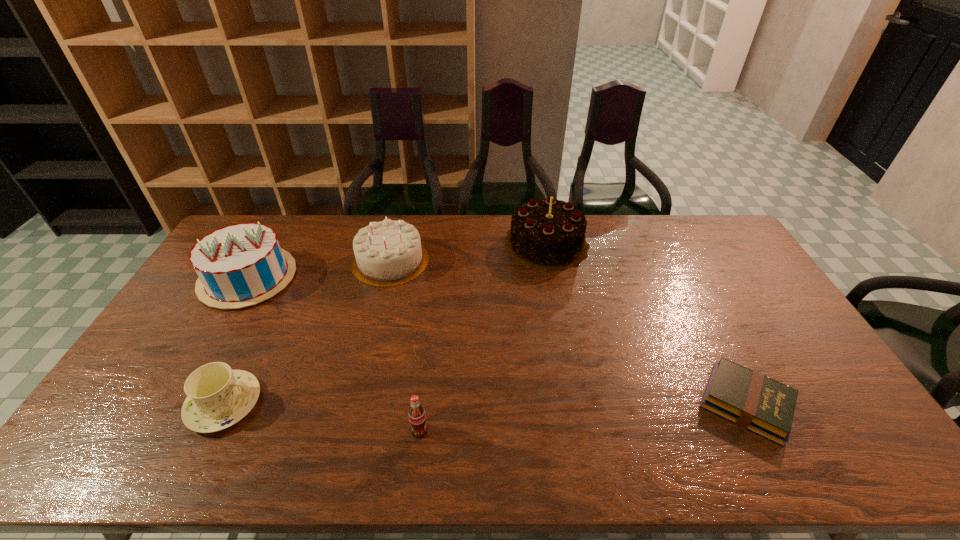
This screenshot has height=540, width=960. What are the coordinates of `the rightmost birthday cake` in the screenshot? It's located at (546, 234).

Find the location of `the leftmost birthday cake`. the leftmost birthday cake is located at coordinates (240, 265).

You are a GUI agent. You are given a task and a screenshot of the screen. Output one action in this format:
    pyautogui.click(x=<x>, y=<y>)
    Task: Click on the shortest birthday cake
    Image resolution: width=960 pixels, height=540 pixels.
    Given the screenshot: What is the action you would take?
    pyautogui.click(x=388, y=253)

Where is `the fourth object from right to left`? The height and width of the screenshot is (540, 960). the fourth object from right to left is located at coordinates (388, 253).

Find the location of a particular element. soda is located at coordinates (417, 417).

Identify the location of chinaware. This screenshot has width=960, height=540. (218, 397).

This screenshot has height=540, width=960. I want to click on book, so coord(753,401).

Find the location of `the rightmost object`. the rightmost object is located at coordinates pyautogui.click(x=753, y=401).

I want to click on free space located on the left of the rightmost birthday cake, so click(x=488, y=244).

Where is `vacant space located 0.140m on the right of the leftmost birthday cake`? The image size is (960, 540). vacant space located 0.140m on the right of the leftmost birthday cake is located at coordinates (335, 278).